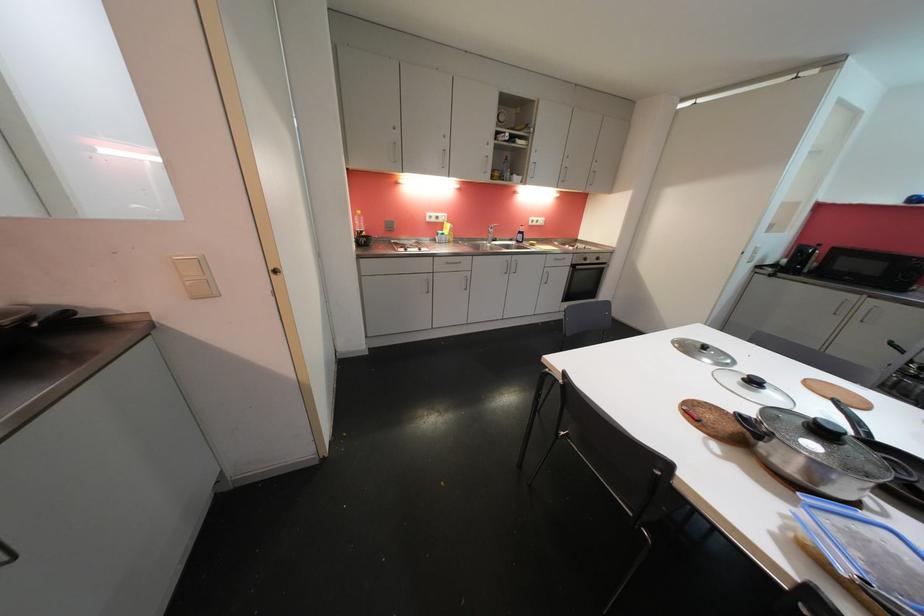
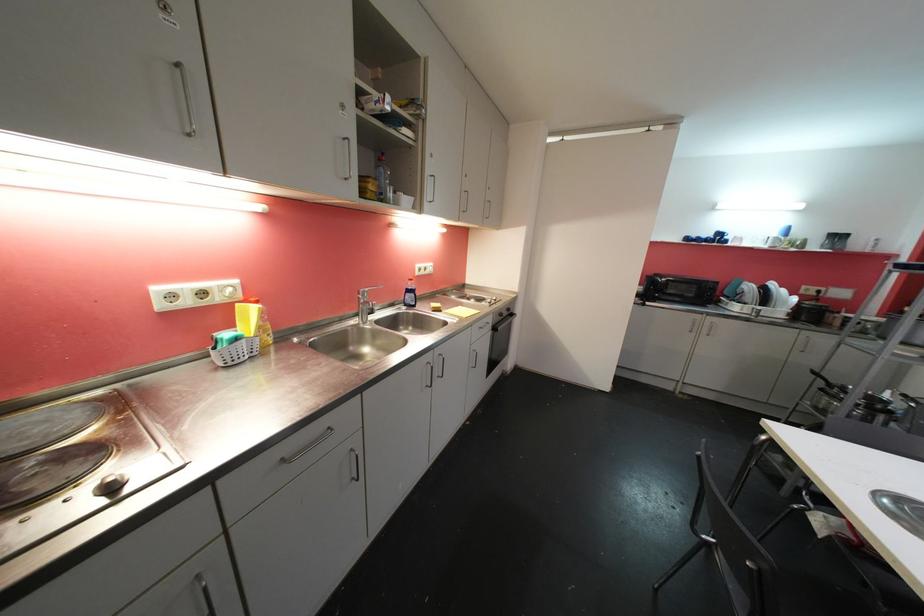
In the second image, find the point that corresponds to pixel 537 163 in the first image.

(432, 174)